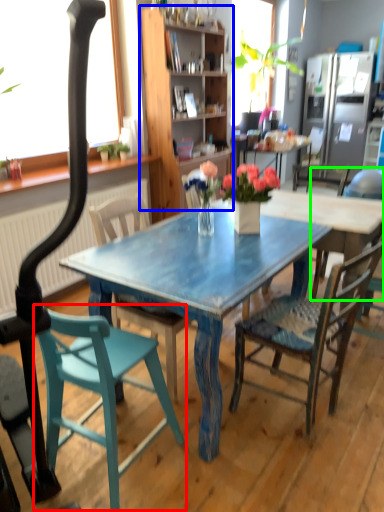
Question: Considering the real-world distances, which object is closest to chair (highlighted by a red box)? cabinetry (highlighted by a blue box) or chair (highlighted by a green box).

Choices:
 (A) cabinetry
 (B) chair

Answer: (B)